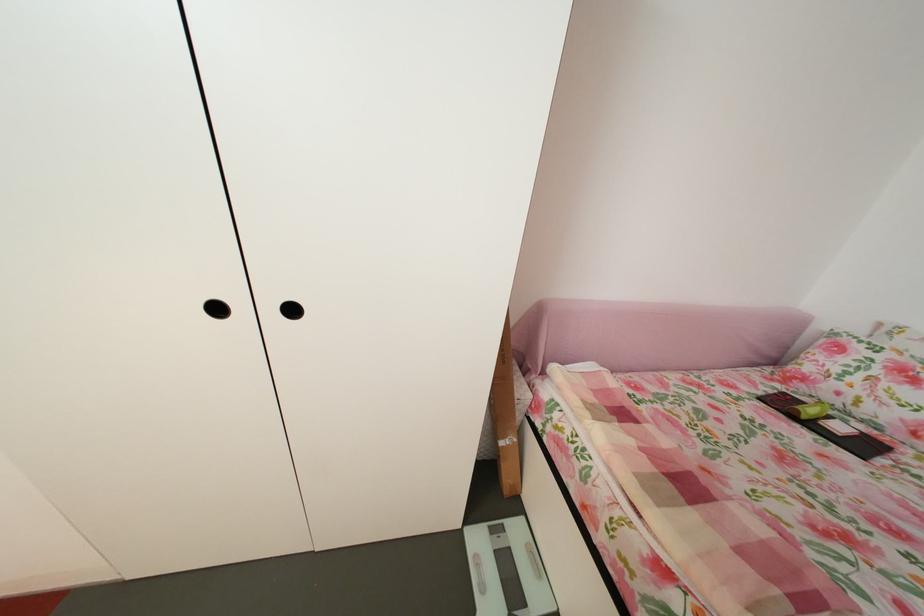
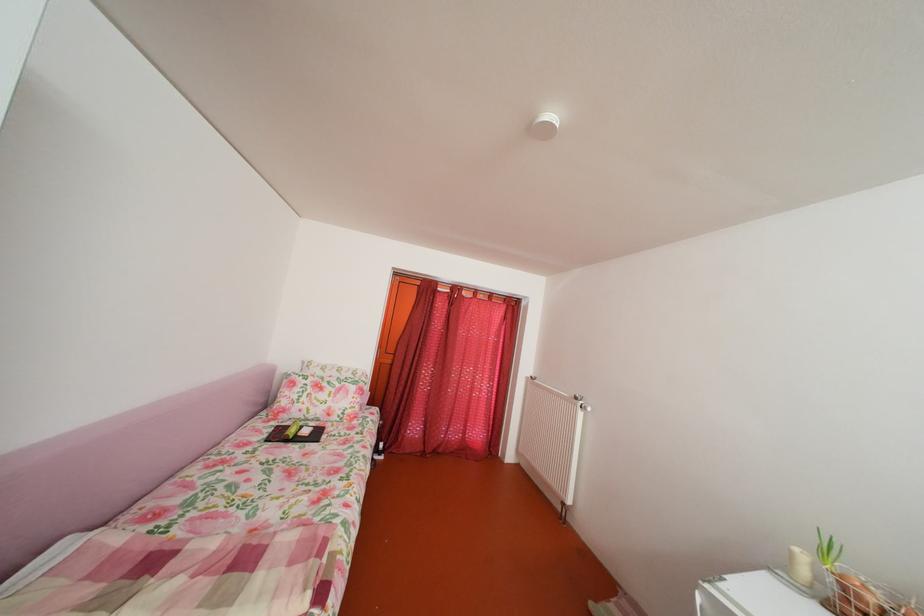
Where in the second image is the point corresponding to the point at 791,392 from the first image?

(286, 430)